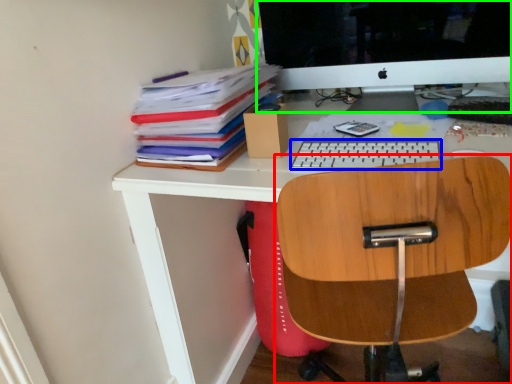
Question: Which is nearer to the chair (highlighted by a red box)? keyboard (highlighted by a blue box) or computer monitor (highlighted by a green box).

Choices:
 (A) keyboard
 (B) computer monitor

Answer: (A)